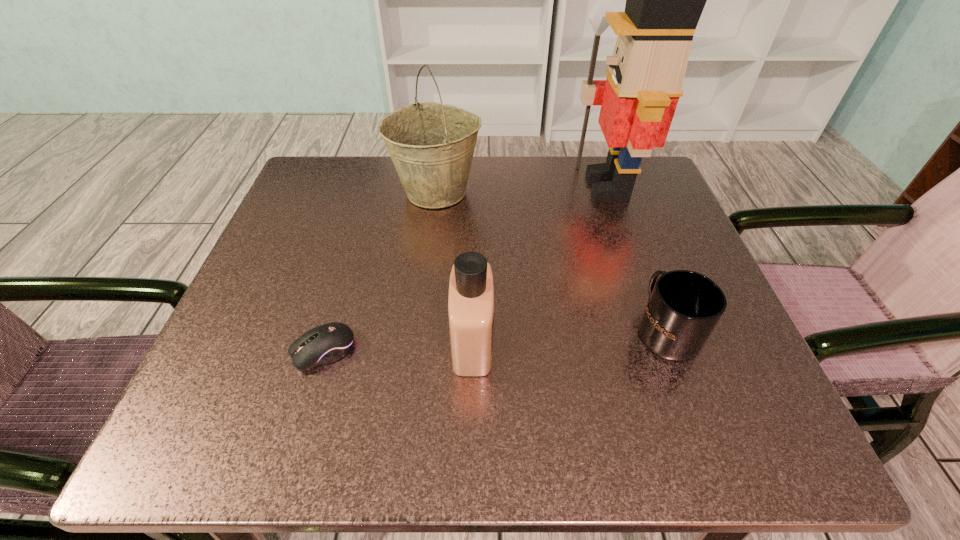
Find the location of `vacant space at the far edge`. vacant space at the far edge is located at coordinates (553, 165).

Locate an element on the screen. This screenshot has height=540, width=960. vacant region at the near edge is located at coordinates (406, 438).

At what (x,y) coordinates should I click in order to perform the action: click on vacant area at the left edge of the desktop. Please return your answer as a coordinate pair (x, y). The height and width of the screenshot is (540, 960). Looking at the image, I should click on (266, 350).

This screenshot has height=540, width=960. Identify the location of free location at the right edge. (614, 257).

The image size is (960, 540). I want to click on vacant space at the far left corner, so click(354, 172).

Where is `free space at the far right corner`? free space at the far right corner is located at coordinates (657, 189).

Where is `free space at the near right corner`? The image size is (960, 540). free space at the near right corner is located at coordinates (735, 431).

Identify the location of empty space that is in between the perfume and the tallest object. The height and width of the screenshot is (540, 960). (540, 264).

Where is `free space between the perfume and the mug`? This screenshot has width=960, height=540. free space between the perfume and the mug is located at coordinates (569, 336).

At what (x,y) coordinates should I click in order to perform the action: click on free space between the second tallest object and the nutcracker. Please return your answer as a coordinate pair (x, y). Looking at the image, I should click on (521, 189).